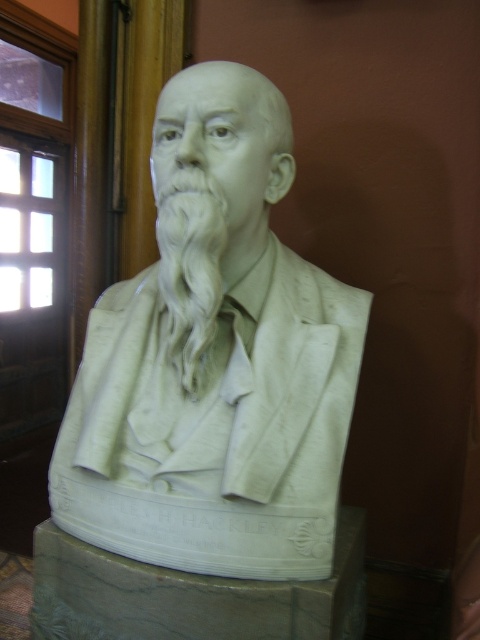
Question: Which object is farther from the camera taking this photo?

Choices:
 (A) white marble beard at center
 (B) white marble bust at center

Answer: (A)

Question: Where is white marble bust at center located in relation to white marble beard at center in the image?

Choices:
 (A) right
 (B) left

Answer: (A)

Question: Is white marble bust at center closer to camera compared to white marble beard at center?

Choices:
 (A) yes
 (B) no

Answer: (A)

Question: Considering the relative positions of white marble bust at center and white marble beard at center in the image provided, where is white marble bust at center located with respect to white marble beard at center?

Choices:
 (A) above
 (B) below

Answer: (B)

Question: Which point is closer to the camera?

Choices:
 (A) white marble beard at center
 (B) white marble bust at center

Answer: (B)